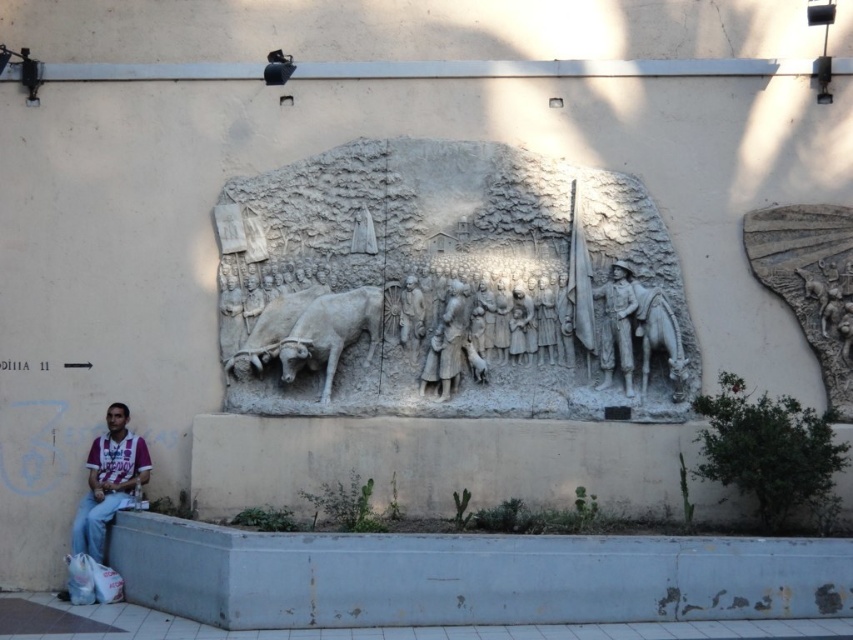
You are standing in front of the sculpture and want to take a photo of the maroon jersey at lower left. If your camera can focus on objects up to 80 feet away, will you be able to capture a clear image?

The maroon jersey at lower left is 79.04 feet away from the viewer. Since the camera can focus up to 80 feet, you can capture a clear image as the distance is within range.